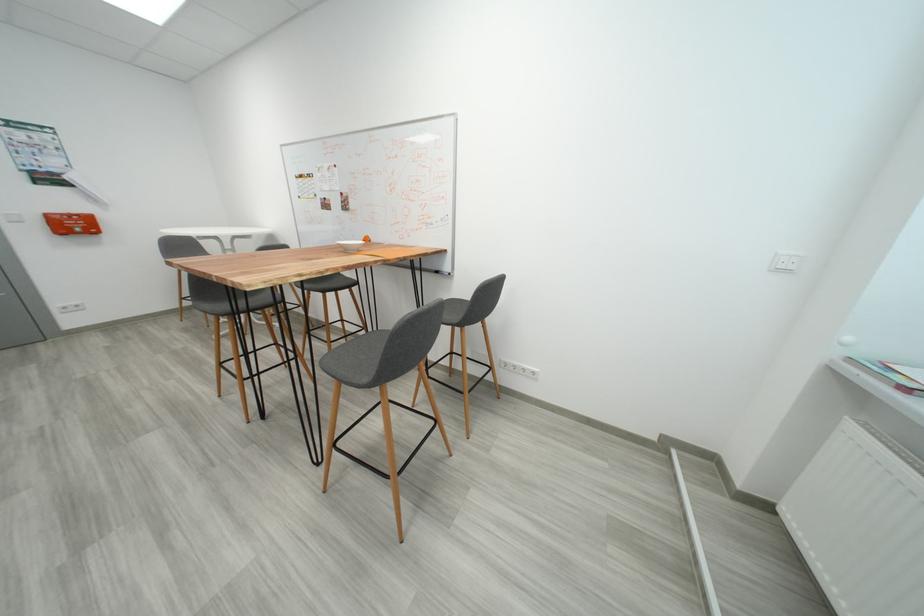
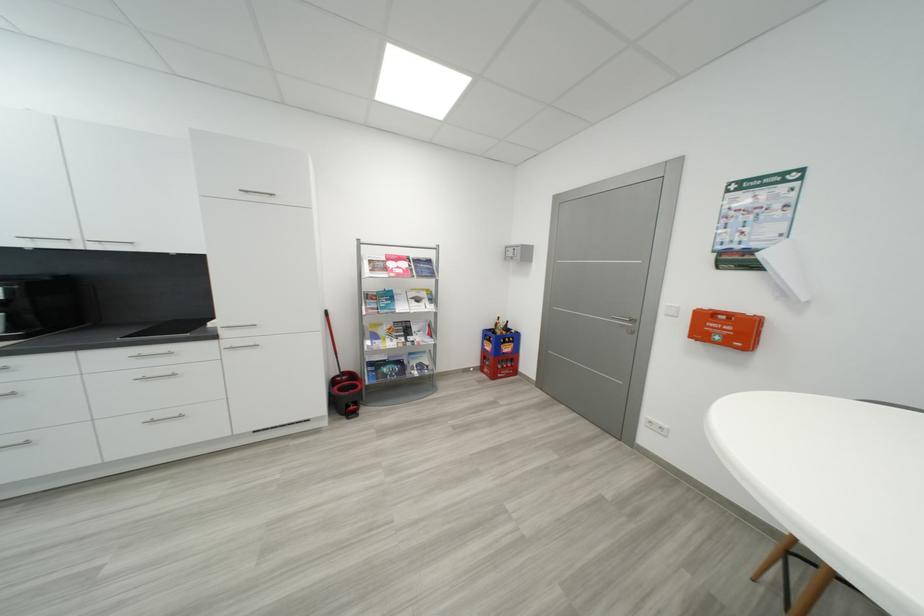
In the second image, find the point that corresponds to the point at 82,228 in the first image.

(733, 333)